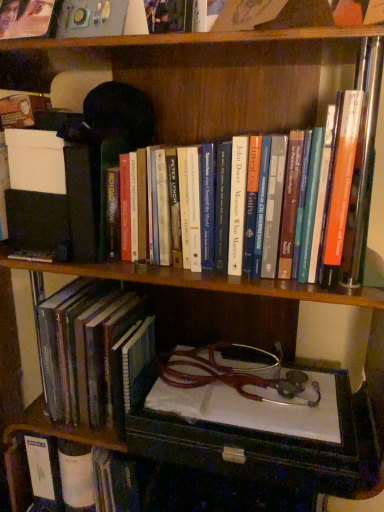
Question: From a real-world perspective, is hardcover book at lower left, the 2th book from the bottom, positioned over hardcover books at center, which is the third book from bottom to top, based on gravity?

Choices:
 (A) yes
 (B) no

Answer: (B)

Question: Can you confirm if hardcover book at lower left, the 2th book from the bottom, is bigger than hardcover books at center, the first book when ordered from top to bottom?

Choices:
 (A) no
 (B) yes

Answer: (A)

Question: From a real-world perspective, is hardcover book at lower left, which is the 2th book from top to bottom, under hardcover books at center, which is the third book from bottom to top?

Choices:
 (A) no
 (B) yes

Answer: (B)

Question: Does hardcover book at lower left, which is the 2th book from top to bottom, have a greater height compared to hardcover books at center, which is the third book from bottom to top?

Choices:
 (A) yes
 (B) no

Answer: (A)

Question: Is hardcover book at lower left, the 2th book from the bottom, oriented towards hardcover books at center, the first book when ordered from top to bottom?

Choices:
 (A) yes
 (B) no

Answer: (B)

Question: Looking at their shapes, would you say hardcover book at lower left, which is the 2th book from top to bottom, is wider or thinner than hardcover book at lower left, acting as the 3th book starting from the top?

Choices:
 (A) thin
 (B) wide

Answer: (A)

Question: From a real-world perspective, is hardcover book at lower left, which is the 2th book from top to bottom, above or below hardcover book at lower left, acting as the 3th book starting from the top?

Choices:
 (A) above
 (B) below

Answer: (A)

Question: Considering the positions of point (49, 326) and point (59, 463), is point (49, 326) closer or farther from the camera than point (59, 463)?

Choices:
 (A) closer
 (B) farther

Answer: (A)

Question: Based on their sizes in the image, would you say hardcover book at lower left, the 2th book from the bottom, is bigger or smaller than hardcover book at lower left, acting as the 1th book starting from the bottom?

Choices:
 (A) small
 (B) big

Answer: (B)

Question: Considering their positions, is hardcover book at lower left, acting as the 3th book starting from the top, located in front of or behind hardcover book at lower left, the 2th book from the bottom?

Choices:
 (A) front
 (B) behind

Answer: (B)

Question: Considering the positions of hardcover book at lower left, acting as the 3th book starting from the top, and hardcover book at lower left, which is the 2th book from top to bottom, in the image, is hardcover book at lower left, acting as the 3th book starting from the top, taller or shorter than hardcover book at lower left, which is the 2th book from top to bottom,?

Choices:
 (A) tall
 (B) short

Answer: (B)

Question: Based on their sizes in the image, would you say hardcover book at lower left, acting as the 1th book starting from the bottom, is bigger or smaller than hardcover book at lower left, the 2th book from the bottom?

Choices:
 (A) small
 (B) big

Answer: (A)

Question: Is hardcover book at lower left, acting as the 1th book starting from the bottom, wider or thinner than hardcover book at lower left, the 2th book from the bottom?

Choices:
 (A) wide
 (B) thin

Answer: (A)

Question: Relative to hardcover book at lower left, the 2th book from the bottom, is hardcover books at center, which is the third book from bottom to top, in front or behind?

Choices:
 (A) behind
 (B) front

Answer: (B)

Question: Based on their sizes in the image, would you say hardcover books at center, the first book when ordered from top to bottom, is bigger or smaller than hardcover book at lower left, the 2th book from the bottom?

Choices:
 (A) big
 (B) small

Answer: (A)